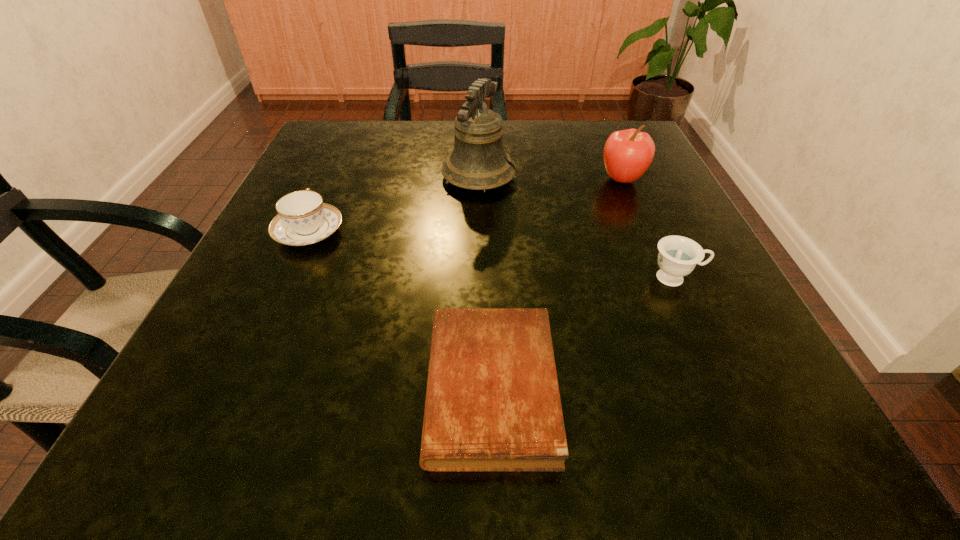
Identify the location of free space located on the side with the handle of the left teacup. (341, 162).

The height and width of the screenshot is (540, 960). I want to click on blank space located on the side with the handle of the left teacup, so click(345, 153).

What are the coordinates of `vacant space located on the side with the handle of the left teacup` in the screenshot? It's located at (332, 180).

Locate an element on the screen. The image size is (960, 540). free space located on the spine side of the Bible is located at coordinates point(363,389).

This screenshot has height=540, width=960. I want to click on free space located 0.280m on the spine side of the Bible, so click(200, 389).

This screenshot has width=960, height=540. Find the location of `free space located 0.250m on the spine side of the Bible`. free space located 0.250m on the spine side of the Bible is located at coordinates (224, 389).

Where is `bell at the far edge`? The width and height of the screenshot is (960, 540). bell at the far edge is located at coordinates (478, 161).

Identify the location of apple present at the far edge. The image size is (960, 540). (627, 155).

The height and width of the screenshot is (540, 960). I want to click on object that is at the near edge, so click(x=493, y=404).

You are a GUI agent. You are given a task and a screenshot of the screen. Output one action in this format:
    pyautogui.click(x=<x>, y=<y>)
    Task: Click on the object located in the left edge section of the desktop
    
    Given the screenshot: What is the action you would take?
    pyautogui.click(x=303, y=219)